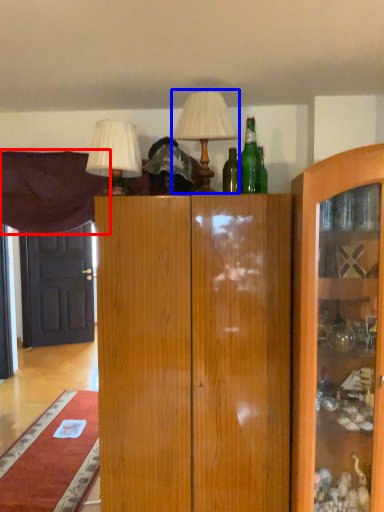
Question: Which object appears closest to the camera in this image, curtain (highlighted by a red box) or table lamp (highlighted by a blue box)?

Choices:
 (A) curtain
 (B) table lamp

Answer: (B)